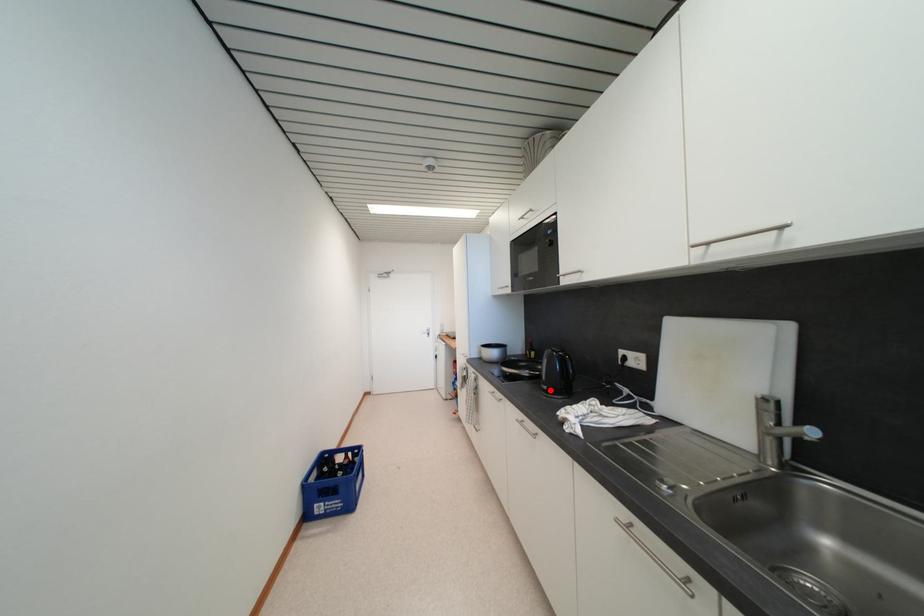
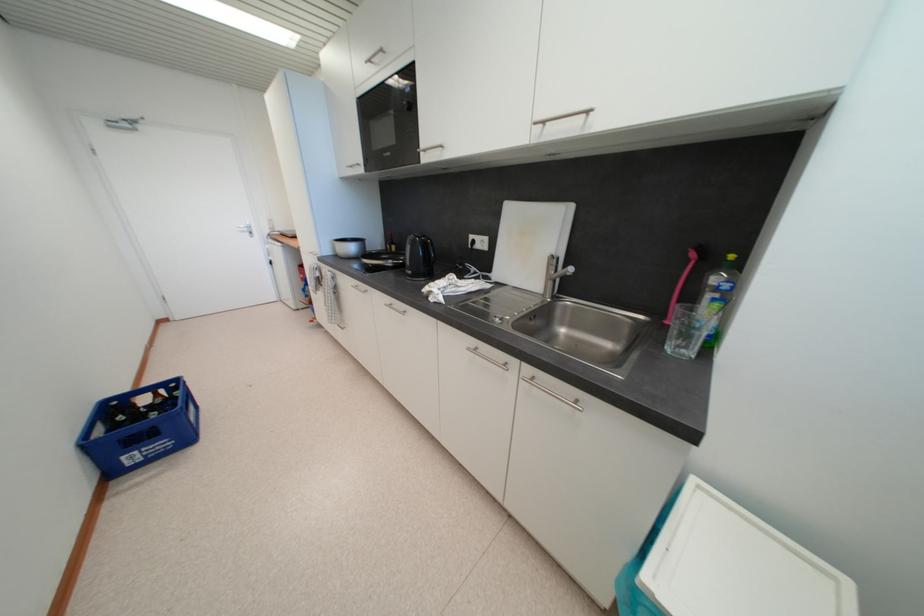
In the second image, find the point that corresponds to the highlighted location in the first image.

(415, 275)